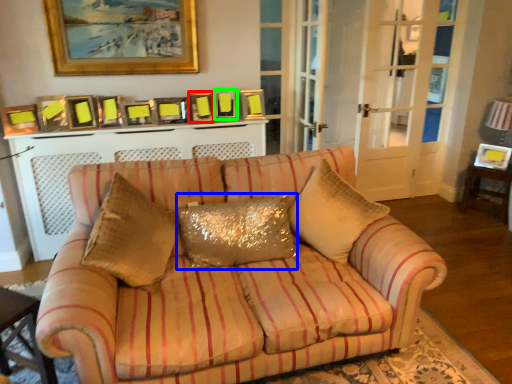
Question: Which is nearer to the picture frame (highlighted by a red box)? pillow (highlighted by a blue box) or picture frame (highlighted by a green box).

Choices:
 (A) pillow
 (B) picture frame

Answer: (B)